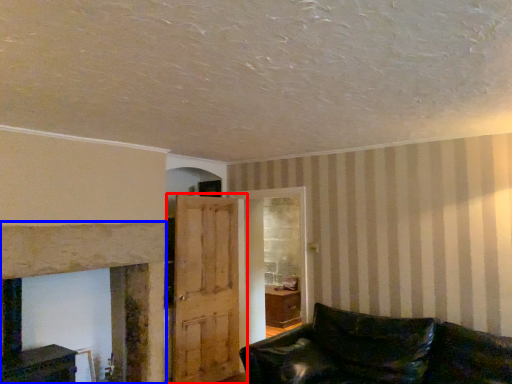
Question: Among these objects, which one is nearest to the camera, door (highlighted by a red box) or fireplace (highlighted by a blue box)?

Choices:
 (A) door
 (B) fireplace

Answer: (B)